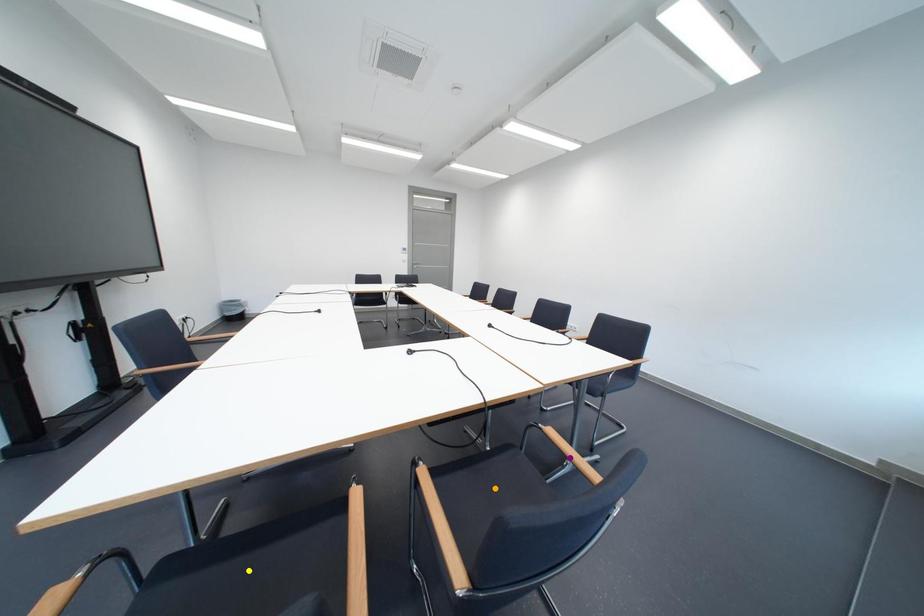
Order these from nearest to farthest:
- orange point
- purple point
- yellow point

1. yellow point
2. purple point
3. orange point